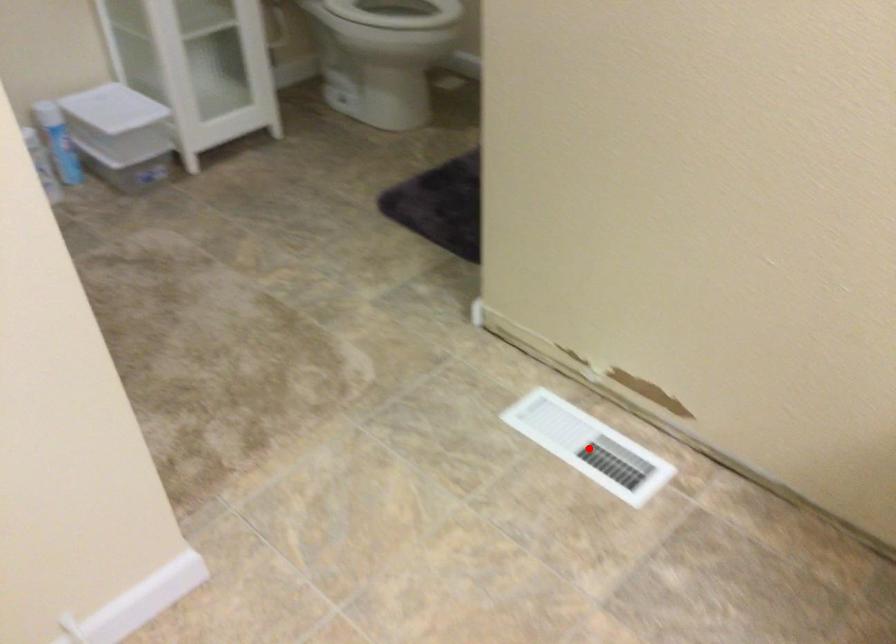
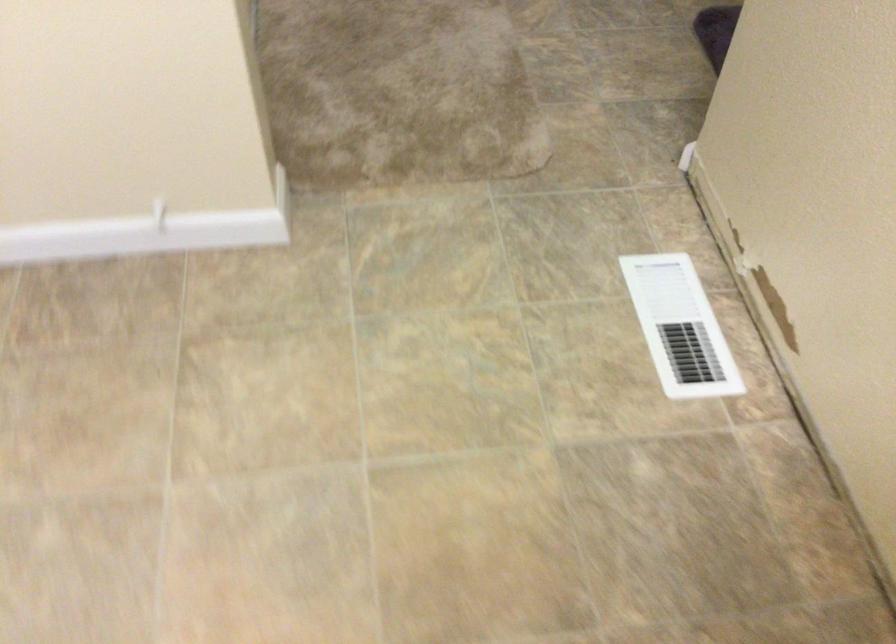
Where in the second image is the point corresponding to the highlighted location from the first image?

(679, 327)